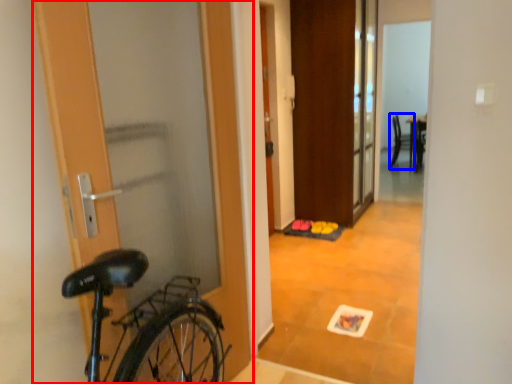
Question: Which object appears farthest to the camera in this image, door (highlighted by a red box) or chair (highlighted by a blue box)?

Choices:
 (A) door
 (B) chair

Answer: (B)